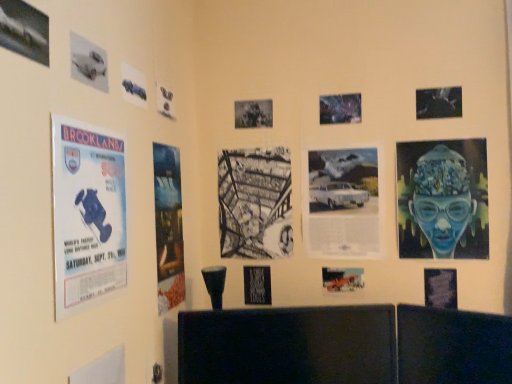
Question: Considering the relative positions of metallic silver poster at upper center, which is the 9th poster in left-to-right order, and black glossy tv at lower center in the image provided, is metallic silver poster at upper center, which is the 9th poster in left-to-right order, to the left or to the right of black glossy tv at lower center?

Choices:
 (A) left
 (B) right

Answer: (B)

Question: Considering their positions, is metallic silver poster at upper center, which is the 9th poster in left-to-right order, located in front of or behind black glossy tv at lower center?

Choices:
 (A) behind
 (B) front

Answer: (A)

Question: Considering the real-world distances, which object is closest to the blue paper poster at left, marked as the third poster in a left-to-right arrangement?

Choices:
 (A) blue paper poster at left, which is the ninth poster in right-to-left order
 (B) metallic silver poster at upper center, which is the sixth poster in right-to-left order
 (C) metallic silver poster at upper right, which is the 3th poster from right to left
 (D) metallic silver airplane at center, the fifth poster positioned from the right
 (E) matte black poster at lower right, marked as the second poster in a right-to-left arrangement

Answer: (A)

Question: Which is nearer to the metallic silver poster at upper left, the first poster positioned from the left?

Choices:
 (A) white paper at center, which is the 11th poster from left to right
 (B) metallic blue car at upper left, the fourth poster from the left
 (C) blue glossy portrait at right, which is the fourteenth poster in left-to-right order
 (D) black glossy tv at lower center
 (E) blue paper poster at left, which is the ninth poster in right-to-left order

Answer: (B)